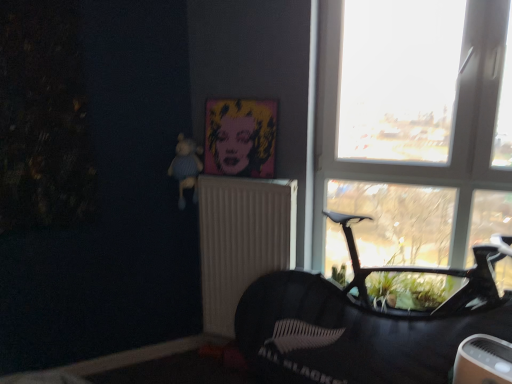
Locate an element on the screen. The height and width of the screenshot is (384, 512). vacant area situated below blue knitted bear at upper left (from a real-world perspective) is located at coordinates tap(189, 350).